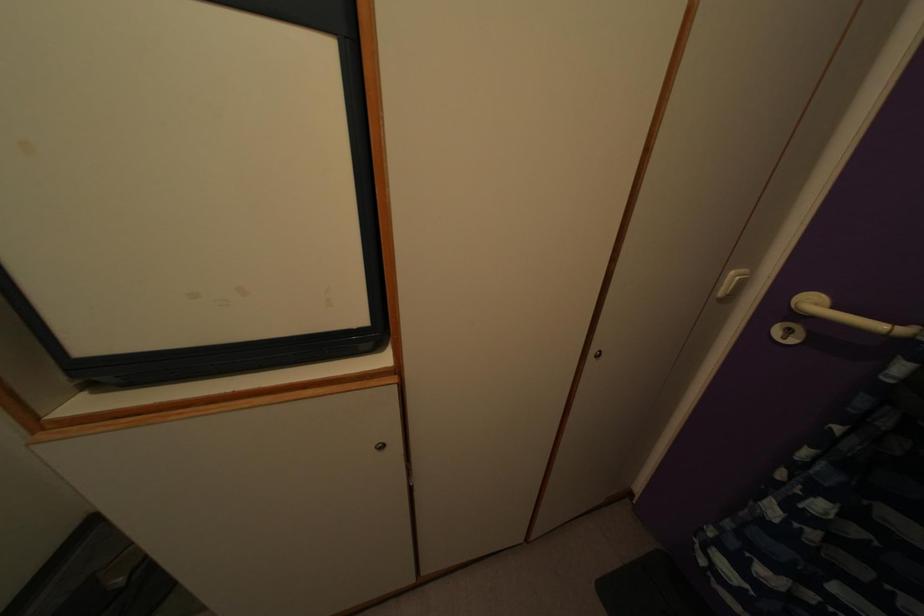
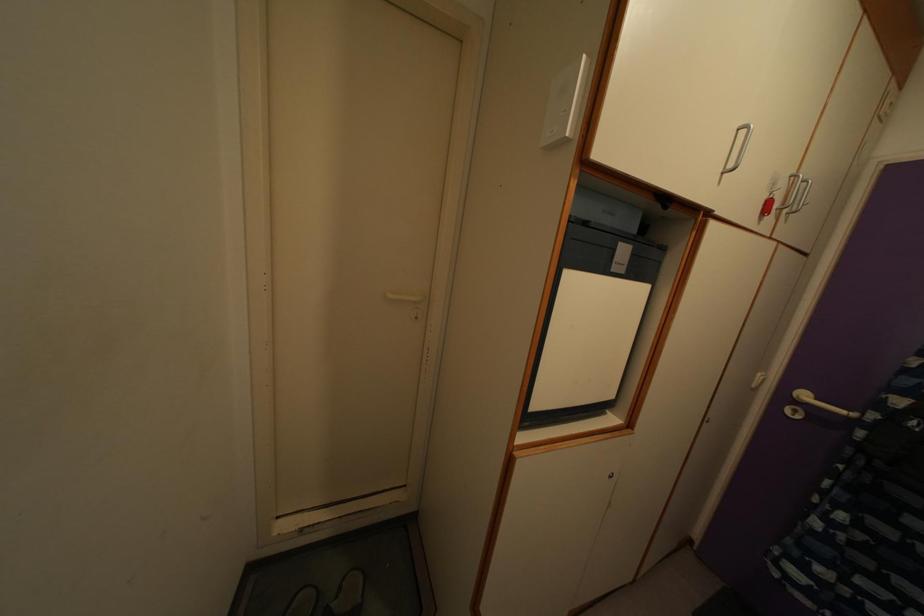
Question: The first image is from the beginning of the video and the second image is from the end. How did the camera likely rotate when shooting the video?

Choices:
 (A) Left
 (B) Right
 (C) Up
 (D) Down

Answer: (C)